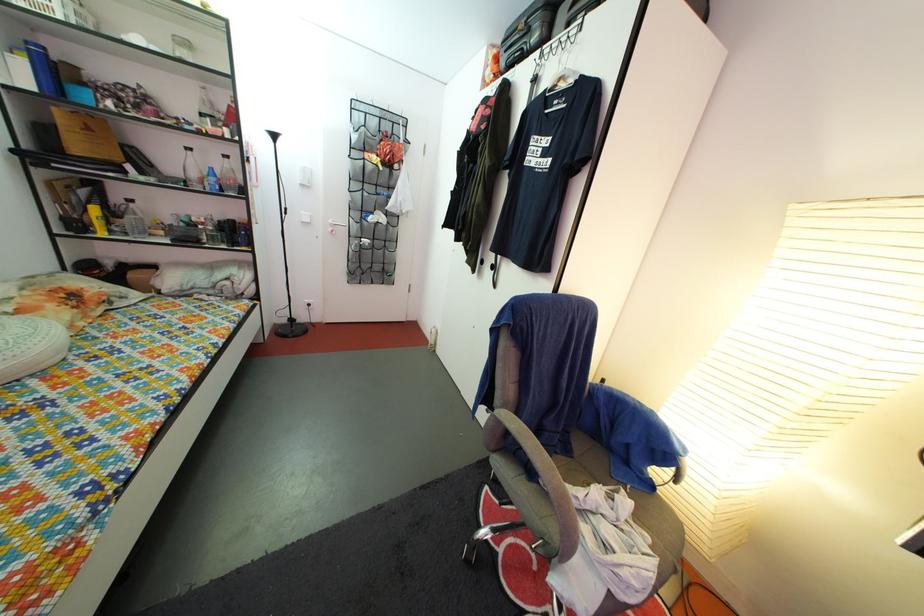
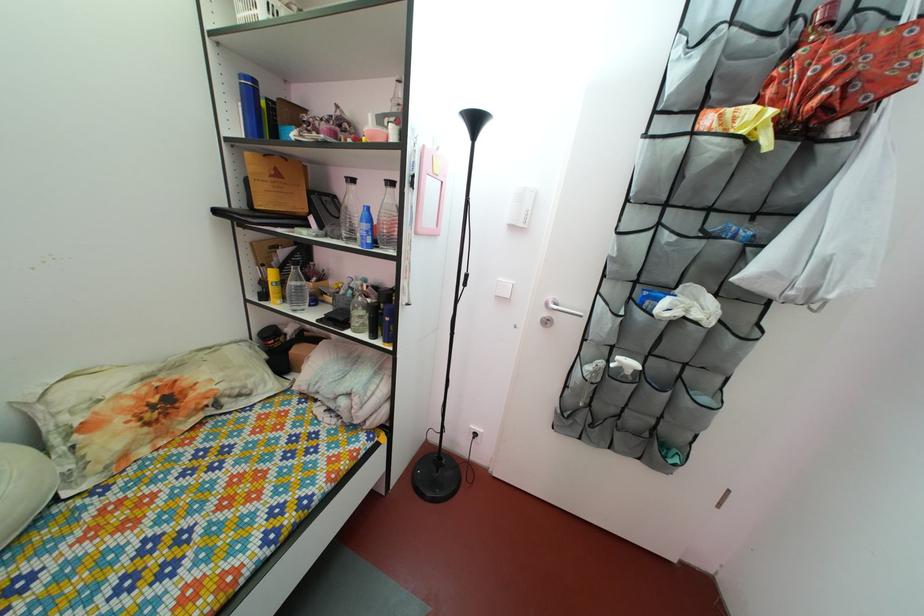
The point at (92, 201) is marked in the first image. Where is the corresponding point in the second image?

(292, 262)